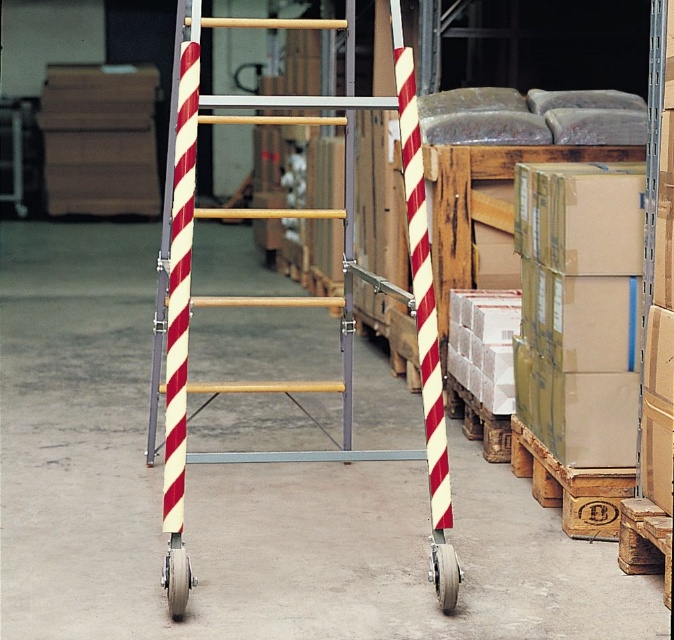
You are a warehouse worker who needs to reach a high shelf. You see the red and white striped ladder at center and the gray rubber wheel at lower left. Which object can you use to reach the high shelf?

The red and white striped ladder at center is much taller than the gray rubber wheel at lower left, so you can use the red and white striped ladder at center to reach the high shelf.

You are navigating a warehouse and need to move from point A to point B. Point A is at the location of point (191, 72) and point B is at point (166, 604). According to the warehouse layout, which direction should you move to go from point A to point B?

To move from point A at (191, 72) to point B at (166, 604), you should move towards the direction where point B is located, which is in front of point A since point (191, 72) is behind point (166, 604).

You are a warehouse worker who needs to move the metallic silver ladder at center to a different location. The gray rubber wheel at lower center is blocking the path. Which direction should you move the ladder to avoid the wheel?

The metallic silver ladder at center is positioned on the left side of the gray rubber wheel at lower center. To avoid the wheel, you should move the ladder to the right side of the gray rubber wheel at lower center.